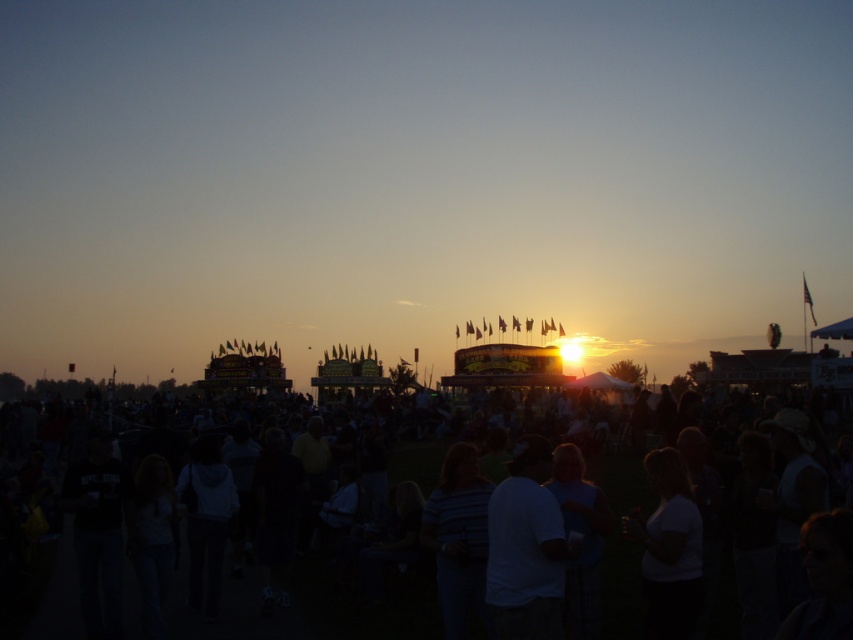
Who is lower down, black matte crowd at center or white matte shirt at center?

white matte shirt at center is lower down.

Image resolution: width=853 pixels, height=640 pixels. In order to click on black matte crowd at center in this screenshot , I will do `click(45, 596)`.

Where is `black matte crowd at center`? black matte crowd at center is located at coordinates (45, 596).